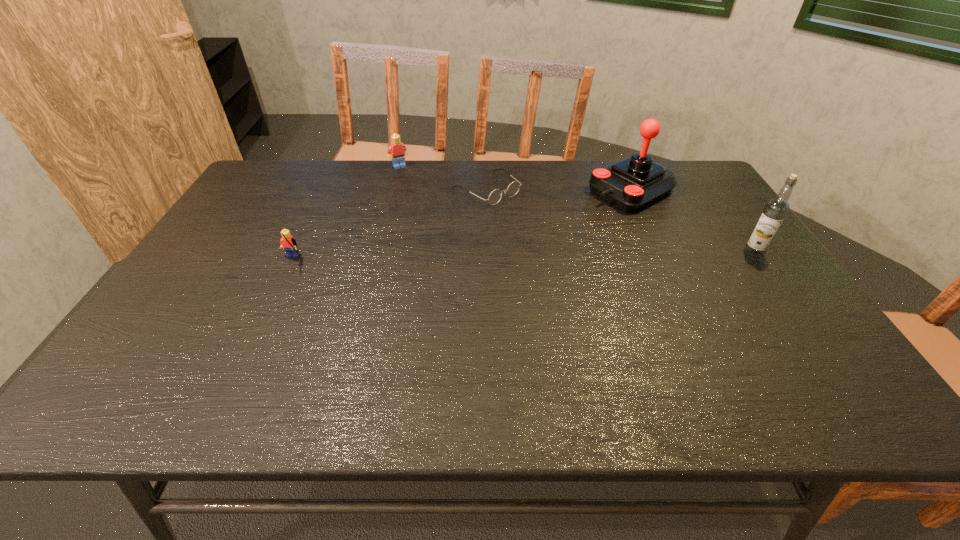
This screenshot has width=960, height=540. Find the location of `vacant area that lies between the leftmost object and the spectacles`. vacant area that lies between the leftmost object and the spectacles is located at coordinates (389, 225).

This screenshot has width=960, height=540. What are the coordinates of `free spot between the third object from right to left and the leftmost object` in the screenshot? It's located at (389, 225).

Where is `empty space that is in between the fourth object from right to left and the vodka`? empty space that is in between the fourth object from right to left and the vodka is located at coordinates (576, 210).

Choose which object is the nearest neighbor to the spectacles. Please provide its 2D coordinates. Your answer should be formatted as a tuple, i.e. [(x, y)], where the tuple contains the x and y coordinates of a point satisfying the conditions above.

[(397, 151)]

At what (x,y) coordinates should I click in order to perform the action: click on object identified as the closest to the joystick. Please return your answer as a coordinate pair (x, y). This screenshot has height=540, width=960. Looking at the image, I should click on (776, 209).

The width and height of the screenshot is (960, 540). In order to click on free space that satisfies the following two spatial constraints: 1. on the front side of the rightmost object; 2. on the label of the third object from right to left in this screenshot , I will do `click(488, 253)`.

The image size is (960, 540). What are the coordinates of `vacant space that satisfies the following two spatial constraints: 1. on the front side of the shortest object; 2. on the label of the vodka` in the screenshot? It's located at (488, 253).